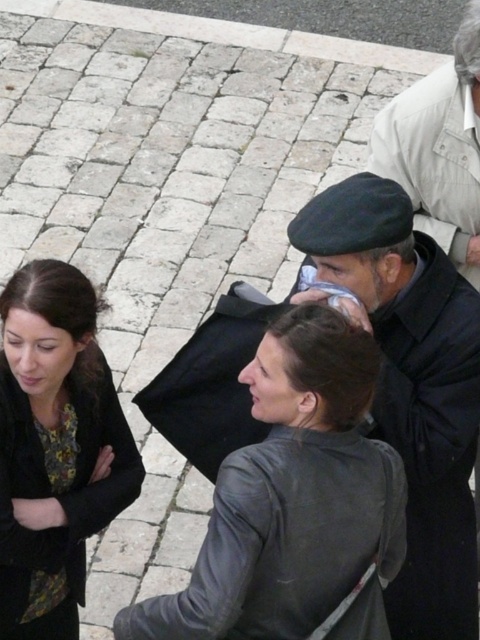
Between point (468, 506) and point (85, 285), which one is positioned in front?

Point (85, 285) is more forward.

Can you confirm if dark gray woolen coat at center is positioned to the right of matte black jacket at left?

Yes, dark gray woolen coat at center is to the right of matte black jacket at left.

Where is `dark gray woolen coat at center`? Image resolution: width=480 pixels, height=640 pixels. dark gray woolen coat at center is located at coordinates (411, 387).

This screenshot has height=640, width=480. What are the coordinates of `dark gray woolen coat at center` in the screenshot? It's located at click(x=411, y=387).

Which is more to the right, dark gray woolen coat at center or dark gray wool beret at center?

dark gray wool beret at center is more to the right.

Measure the distance from dark gray woolen coat at center to dark gray wool beret at center.

A distance of 1.06 meters exists between dark gray woolen coat at center and dark gray wool beret at center.

What do you see at coordinates (411, 387) in the screenshot? This screenshot has height=640, width=480. I see `dark gray woolen coat at center` at bounding box center [411, 387].

Where is `dark gray woolen coat at center`? dark gray woolen coat at center is located at coordinates (411, 387).

Does matte gray jacket at center appear under matte black jacket at left?

Incorrect, matte gray jacket at center is not positioned below matte black jacket at left.

Between point (296, 330) and point (68, 317), which one is positioned in front?

Point (296, 330) is more forward.

Who is more distant from viewer, (325,426) or (56,557)?

The point (56,557) is behind.

Where is `matte gray jacket at center`? The width and height of the screenshot is (480, 640). matte gray jacket at center is located at coordinates (291, 497).